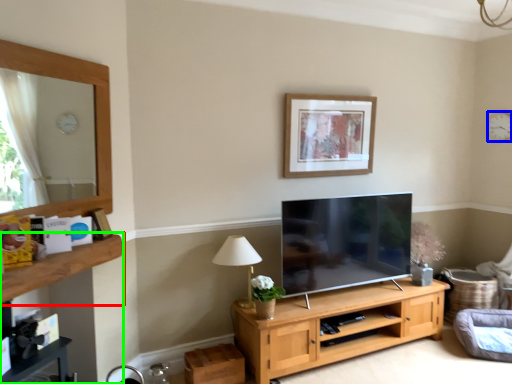
Question: Based on their relative distances, which object is farther from shelf (highlighted by a red box)? Choose from clock (highlighted by a blue box) and dresser (highlighted by a green box).

Choices:
 (A) clock
 (B) dresser

Answer: (A)